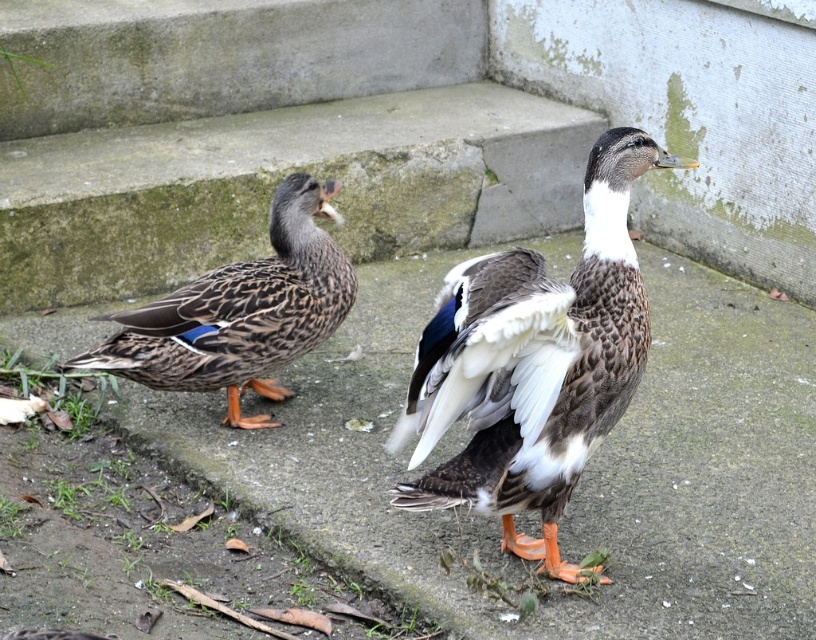
Question: Does gray concrete pavement at center have a smaller size compared to brown speckled feathers at left?

Choices:
 (A) yes
 (B) no

Answer: (B)

Question: Which object is positioned farthest from the brown speckled duck at center?

Choices:
 (A) gray concrete pavement at center
 (B) brown speckled feathers at left

Answer: (B)

Question: Which object is farther from the camera taking this photo?

Choices:
 (A) brown speckled feathers at left
 (B) gray concrete pavement at center
 (C) brown speckled duck at center

Answer: (A)

Question: Does gray concrete pavement at center have a greater width compared to brown speckled duck at center?

Choices:
 (A) no
 (B) yes

Answer: (B)

Question: Can you confirm if gray concrete pavement at center is positioned above brown speckled duck at center?

Choices:
 (A) no
 (B) yes

Answer: (A)

Question: Estimate the real-world distances between objects in this image. Which object is farther from the gray concrete pavement at center?

Choices:
 (A) brown speckled feathers at left
 (B) brown speckled duck at center

Answer: (B)